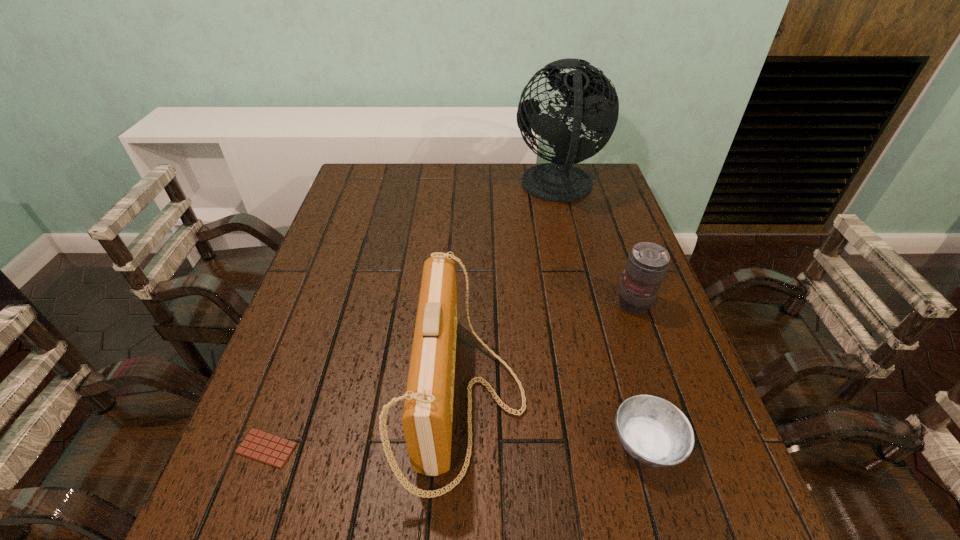
Find the location of `free space that satisfies the following two spatial constraints: 1. on the front-facing side of the tallest object; 2. on the front side of the shortest object`. free space that satisfies the following two spatial constraints: 1. on the front-facing side of the tallest object; 2. on the front side of the shortest object is located at coordinates (620, 448).

Where is `vacant space that satisfies the following two spatial constraints: 1. on the side of the second farthest object where the control switches are located; 2. on the decorative side of the handbag`? vacant space that satisfies the following two spatial constraints: 1. on the side of the second farthest object where the control switches are located; 2. on the decorative side of the handbag is located at coordinates point(667,399).